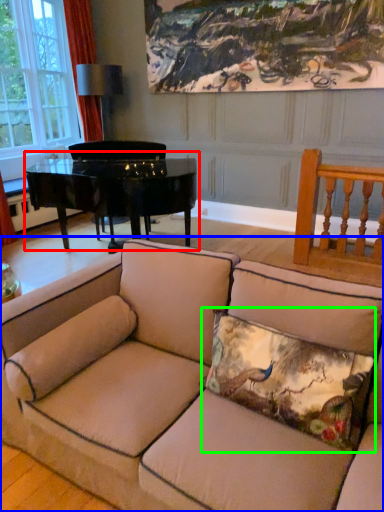
Question: Which object is the farthest from table (highlighted by a red box)? Choose among these: studio couch (highlighted by a blue box) or pillow (highlighted by a green box).

Choices:
 (A) studio couch
 (B) pillow

Answer: (B)